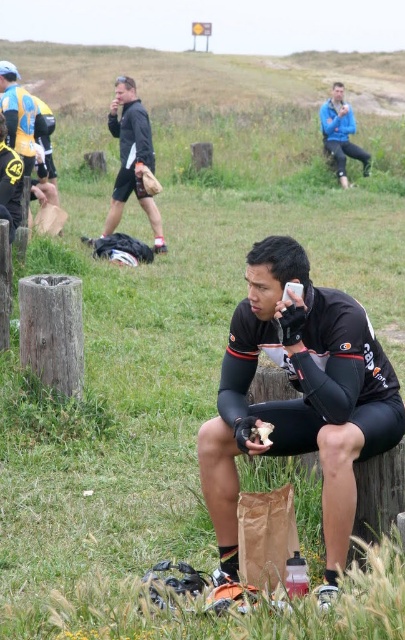
Question: Which point is closer to the camera?

Choices:
 (A) white paper bag at center
 (B) blue fabric jacket at upper center
 (C) black matte shorts at center
 (D) black matte jacket at left

Answer: (C)

Question: Does blue fabric jacket at upper center have a larger size compared to white paper bag at center?

Choices:
 (A) no
 (B) yes

Answer: (B)

Question: Considering the relative positions of black matte shorts at center and blue fabric jacket at upper center in the image provided, where is black matte shorts at center located with respect to blue fabric jacket at upper center?

Choices:
 (A) above
 (B) below

Answer: (B)

Question: Can you confirm if black matte shorts at center is positioned below blue fabric jacket at upper center?

Choices:
 (A) no
 (B) yes

Answer: (B)

Question: Which of the following is the closest to the observer?

Choices:
 (A) (253, 426)
 (B) (343, 132)

Answer: (A)

Question: Which of the following is the closest to the observer?

Choices:
 (A) black matte shorts at center
 (B) black matte jacket at left

Answer: (A)